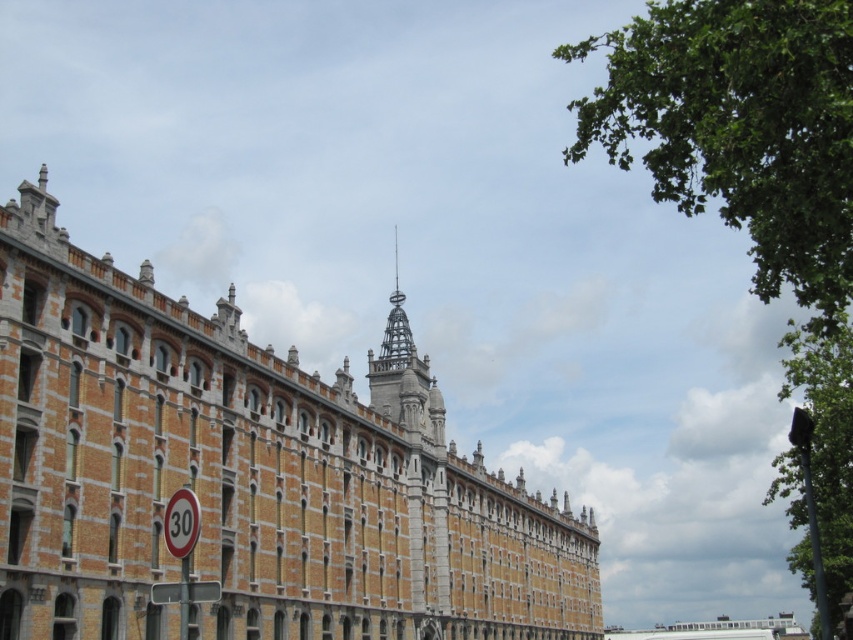
Question: Is brick building at center further to the viewer compared to white plastic sign at lower left?

Choices:
 (A) no
 (B) yes

Answer: (B)

Question: Estimate the real-world distances between objects in this image. Which object is closer to the metallic yellow speed limit sign at lower left?

Choices:
 (A) white plastic sign at lower left
 (B) brick building at center

Answer: (A)

Question: Can you confirm if metallic yellow speed limit sign at lower left is thinner than white plastic sign at lower left?

Choices:
 (A) no
 (B) yes

Answer: (B)

Question: In this image, where is brick building at center located relative to white plastic sign at lower left?

Choices:
 (A) left
 (B) right

Answer: (B)

Question: Which point is closer to the camera?

Choices:
 (A) (173, 592)
 (B) (169, 502)

Answer: (A)

Question: Which object is closer to the camera taking this photo?

Choices:
 (A) brick building at center
 (B) white plastic sign at lower left

Answer: (B)